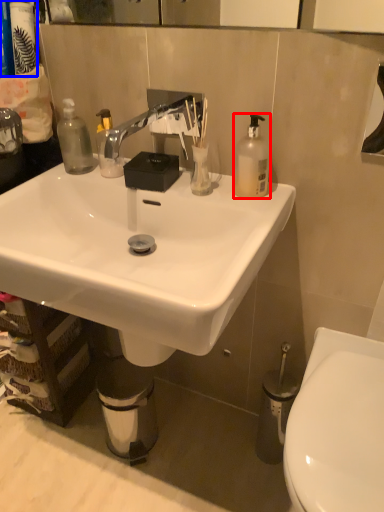
Question: Which of the following is the closest to the observer, bottle (highlighted by a red box) or toiletries (highlighted by a blue box)?

Choices:
 (A) bottle
 (B) toiletries

Answer: (A)